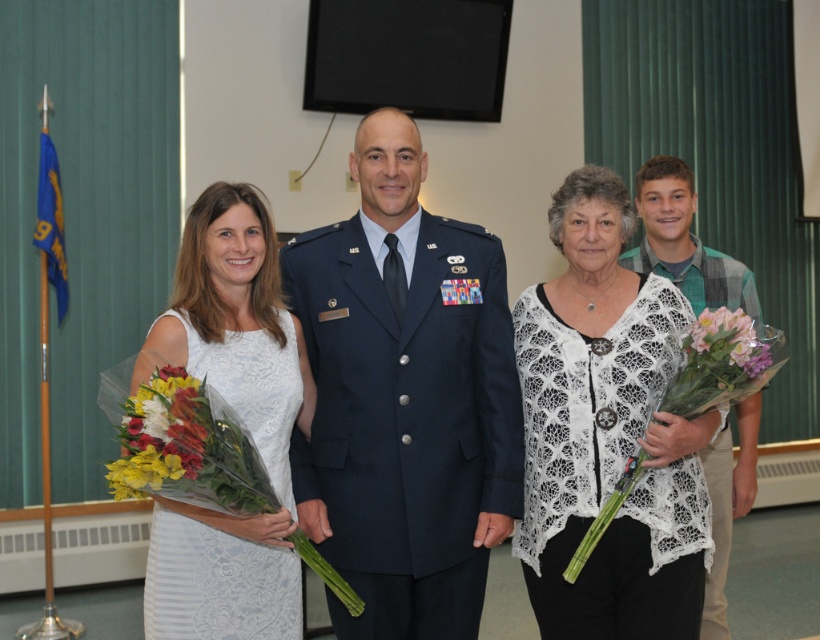
You are attending a formal event and notice two white lace garments at the center of the image. Which one is taller between the white lace cardigan at center and the white lace dress at center?

The white lace cardigan at center is taller than the white lace dress at center according to the description.

You are organizing a photo shoot and need to ensure that the white lace cardigan at center and the glossy floral bouquet at left are both visible in the frame. Given their sizes, which object might require more space in the composition?

The white lace cardigan at center is bigger than the glossy floral bouquet at left, so it would require more space in the composition to ensure it is fully visible.